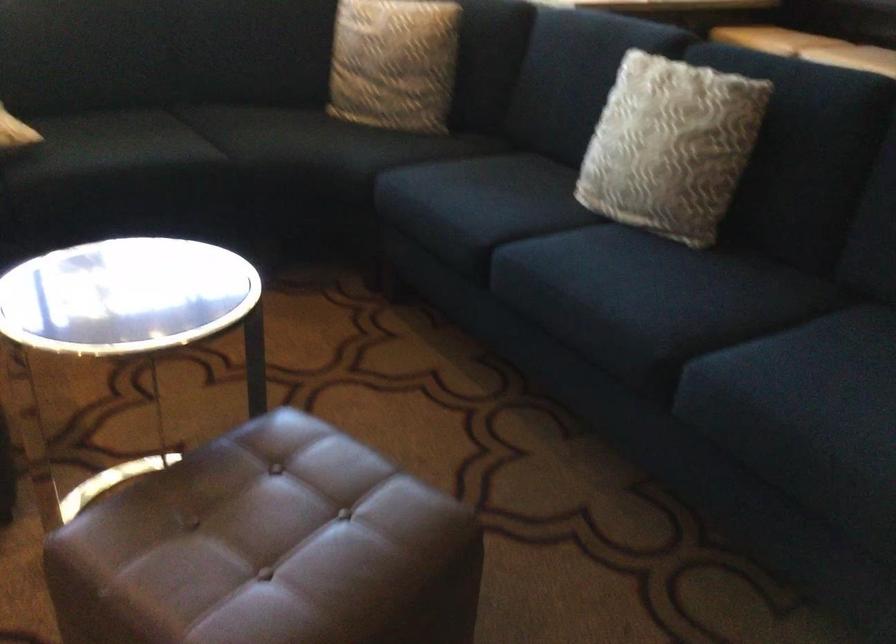
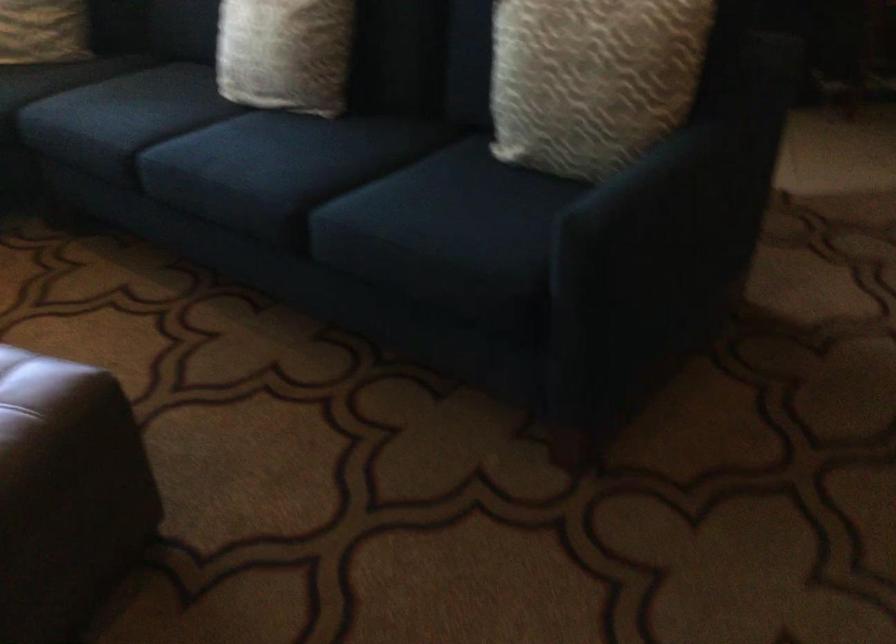
Locate, in the second image, the point that corresponds to point (669, 180) in the first image.

(285, 53)